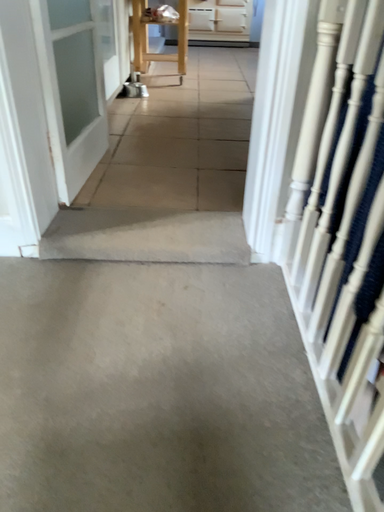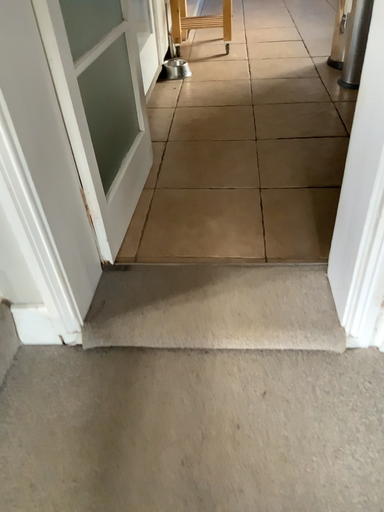
Question: Which way did the camera rotate in the video?

Choices:
 (A) rotated upward
 (B) rotated downward

Answer: (B)